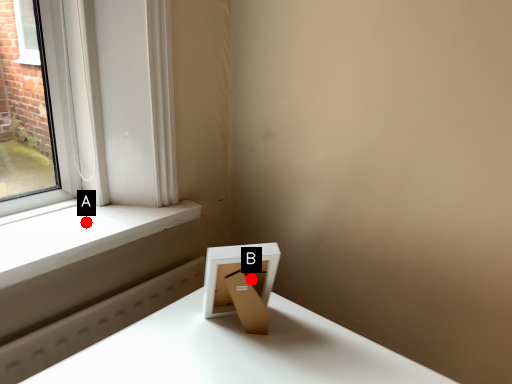
Question: Two points are circled on the image, labeled by A and B beside each circle. Among these points, which one is nearest to the camera?

Choices:
 (A) A is closer
 (B) B is closer

Answer: (B)